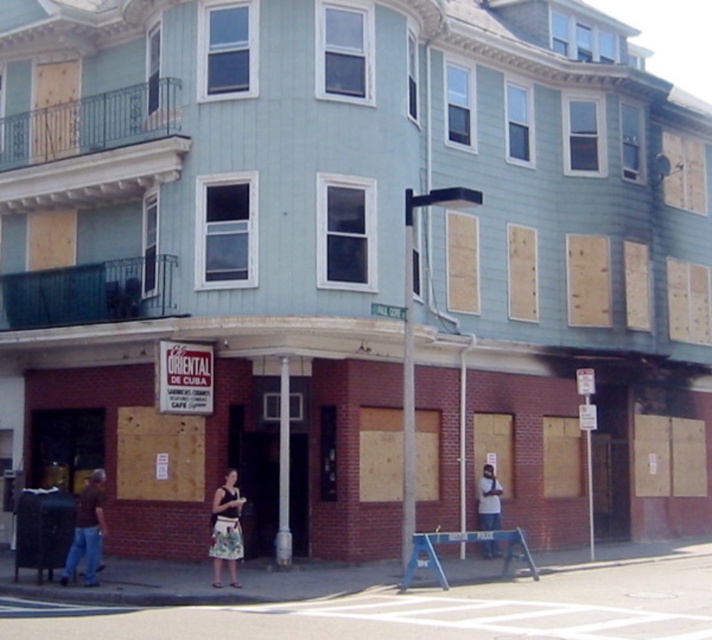
You are a delivery person trying to reach the entrance of the building. The entrance is located where the sign is. You are standing between the brown denim jeans at lower left and the light blue denim jeans at lower center. Which direction should you move to reach the entrance?

The entrance is located where the sign is. Since the sign is at the ground floor where the light blue denim jeans at lower center are positioned, you should move towards the light blue denim jeans at lower center to reach the entrance.

You are a fashion designer observing a model wearing a floral skirt at center and light blue denim jeans at lower center in front of a boarded building. Which piece of clothing is more visible to you?

The floral skirt at center is closer to the viewer than the light blue denim jeans at lower center, so the floral skirt at center is more visible.

You are a delivery person who needs to place a package on the ground near the sign that says El ORIENTAL DE CUB. You see the brown denim jeans at lower left and the floral skirt at center. Which object should you place the package next to to ensure it is closest to the sign?

The brown denim jeans at lower left should be chosen because it is positioned below the floral skirt at center, meaning it is closer to the sign located at the ground level.